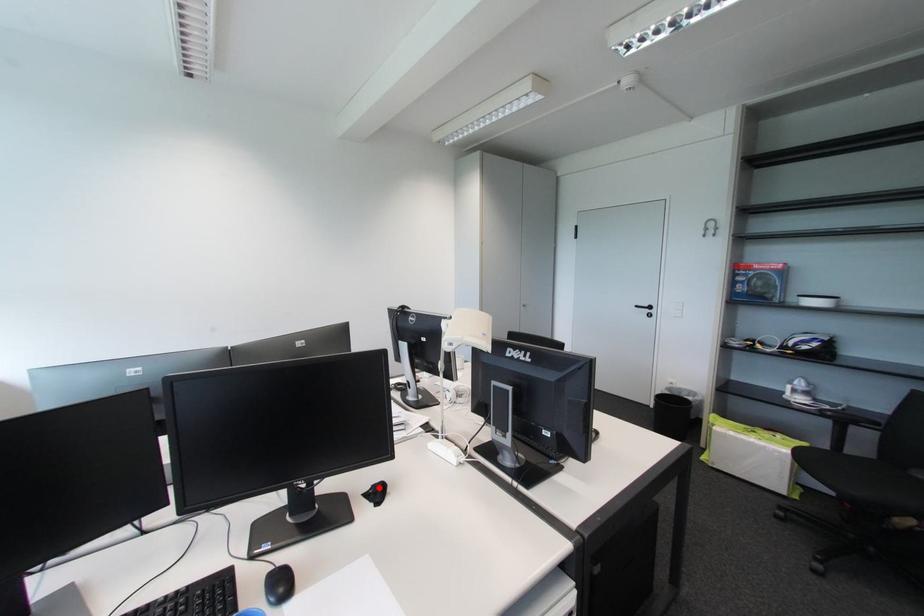
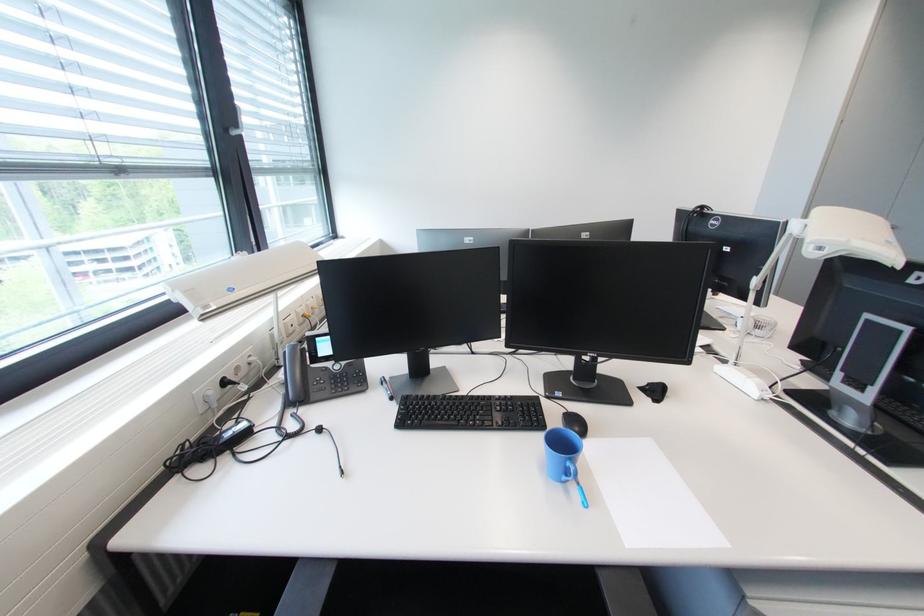
In the second image, find the point that corresponds to the highlighted location in the first image.

(655, 386)